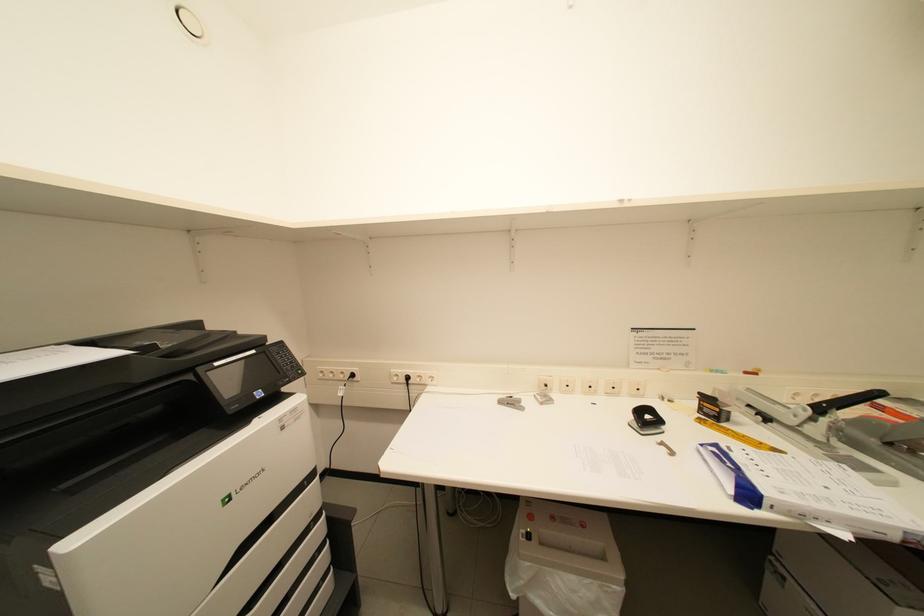
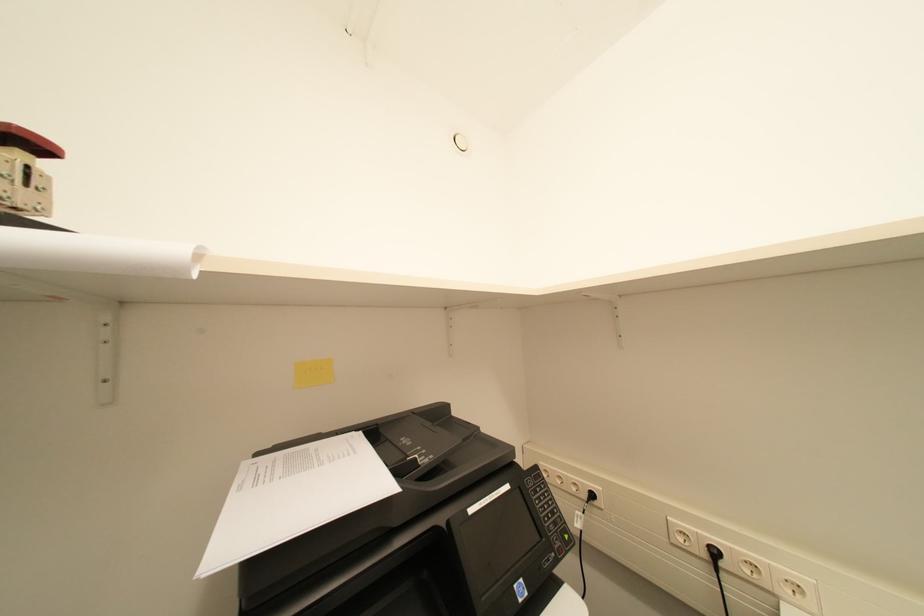
Question: The camera is either moving clockwise (left) or counter-clockwise (right) around the object. The first image is from the beginning of the video and the second image is from the end. Is the camera moving left or right when shooting the video?

Choices:
 (A) Left
 (B) Right

Answer: (B)